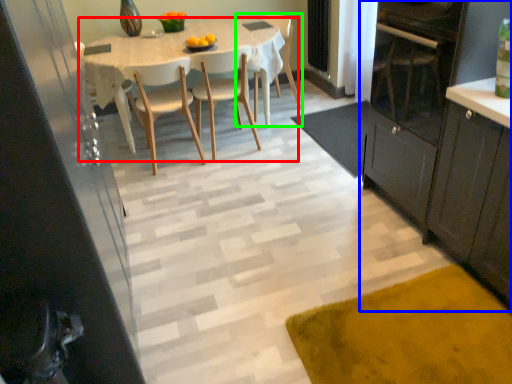
Question: Based on their relative distances, which object is farther from kitchen & dining room table (highlighted by a red box)? Choose from cabinetry (highlighted by a blue box) and chair (highlighted by a green box).

Choices:
 (A) cabinetry
 (B) chair

Answer: (A)